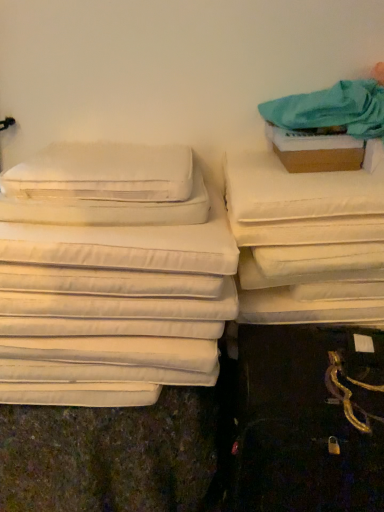
Question: In terms of width, does brown cardboard box at upper right look wider or thinner when compared to white soft pillow at left, the 1th pillow positioned from the bottom?

Choices:
 (A) thin
 (B) wide

Answer: (A)

Question: Is brown cardboard box at upper right in front of or behind white soft pillow at left, the 1th pillow positioned from the bottom, in the image?

Choices:
 (A) front
 (B) behind

Answer: (B)

Question: Which of these objects is positioned farthest from the white soft pillow at left, the second pillow from the top?

Choices:
 (A) white soft pillow at upper left, the 2th pillow positioned from the bottom
 (B) white fabric cushion at upper right, which is counted as the 1th sheet, starting from the top
 (C) white fabric mattress at right
 (D) brown cardboard box at upper right
 (E) white soft fabric at center, which ranks as the second sheet in top-to-bottom order

Answer: (D)

Question: Based on their relative distances, which object is nearer to the white soft pillow at left, the 1th pillow positioned from the bottom?

Choices:
 (A) white soft fabric at center, which ranks as the second sheet in top-to-bottom order
 (B) brown cardboard box at upper right
 (C) white fabric mattress at right
 (D) white fabric cushion at upper right, which ranks as the second sheet in bottom-to-top order
 (E) white soft pillow at upper left, the 2th pillow positioned from the bottom

Answer: (E)